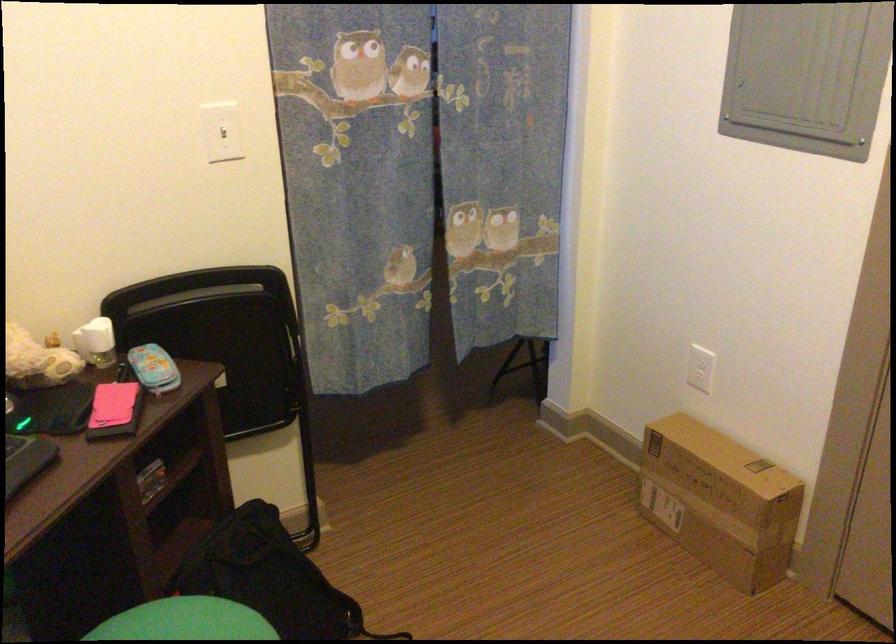
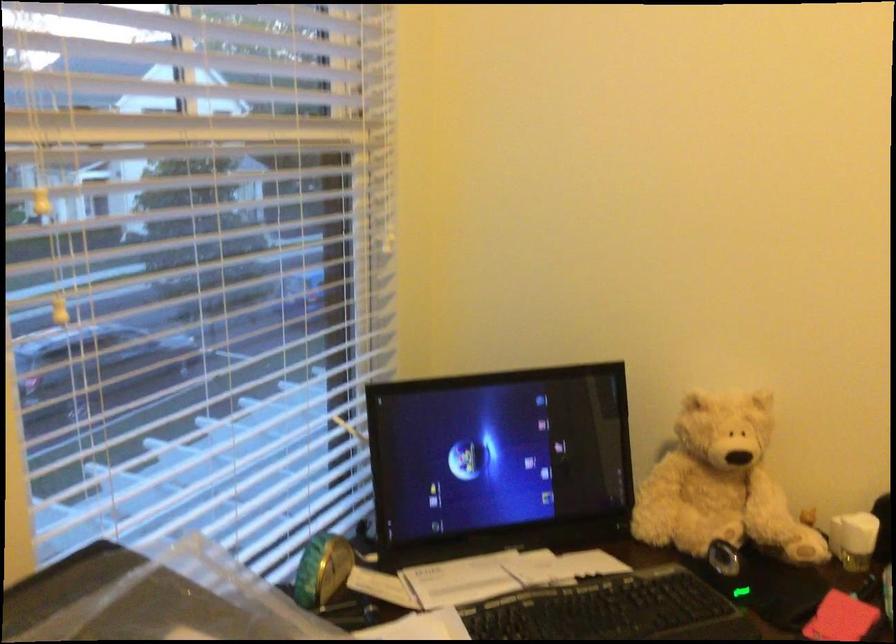
In the second image, find the point that corresponds to pixel 110 404 in the first image.

(840, 618)